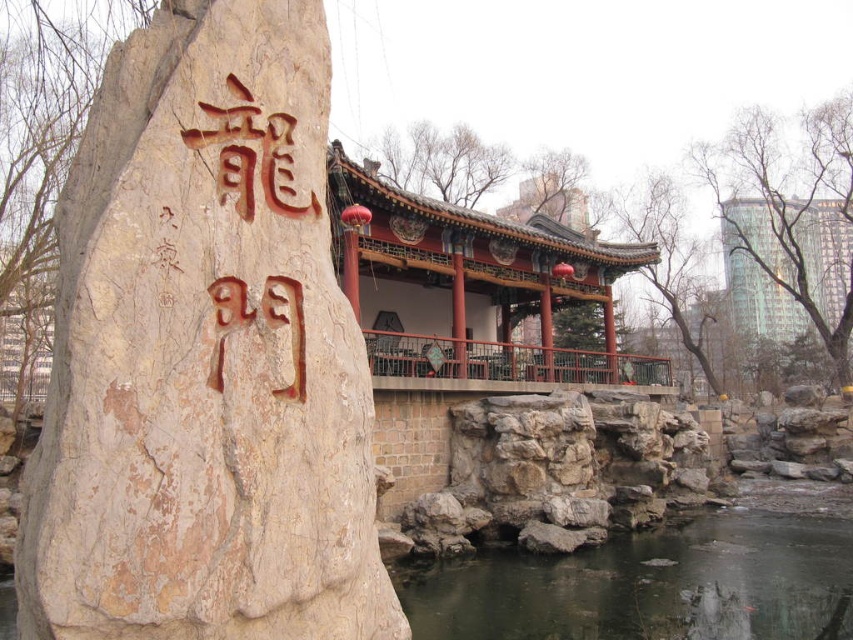
Does brown carved stone at left appear on the right side of brown carved character at upper center?

Indeed, brown carved stone at left is positioned on the right side of brown carved character at upper center.

Image resolution: width=853 pixels, height=640 pixels. I want to click on brown carved stone at left, so click(252, 156).

Between beige stone boulder at center and clear water at lower center, which one has less height?

Standing shorter between the two is clear water at lower center.

Measure the distance between beige stone boulder at center and camera.

beige stone boulder at center and camera are 3.28 meters apart.

Which is behind, point (62, 394) or point (838, 636)?

The point (838, 636) is more distant.

At what (x,y) coordinates should I click in order to perform the action: click on beige stone boulder at center. Please return your answer as a coordinate pair (x, y). The height and width of the screenshot is (640, 853). Looking at the image, I should click on (204, 355).

Is point (503, 586) closer to camera compared to point (260, 129)?

No, (503, 586) is further to viewer.

Based on the photo, can you confirm if clear water at lower center is positioned to the left of brown carved character at upper center?

In fact, clear water at lower center is to the right of brown carved character at upper center.

Does point (787, 609) come behind point (276, 193)?

Yes.

The image size is (853, 640). In order to click on clear water at lower center in this screenshot , I will do `click(648, 586)`.